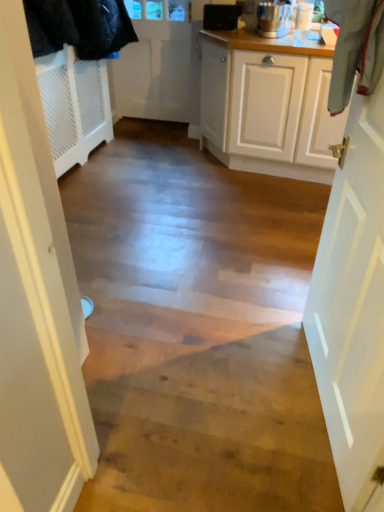
Image resolution: width=384 pixels, height=512 pixels. I want to click on vacant space behind white matte door at right, the first door positioned from the bottom, so click(x=259, y=304).